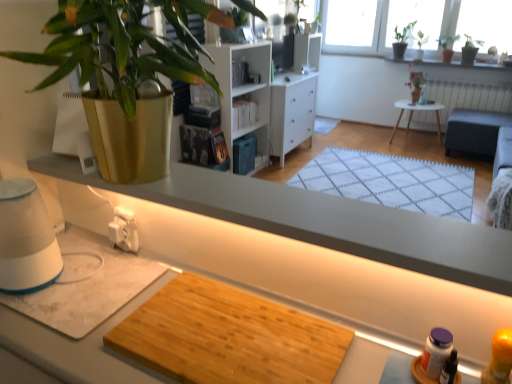
This screenshot has width=512, height=384. What do you see at coordinates (78, 347) in the screenshot? I see `wooden cutting board at center` at bounding box center [78, 347].

Describe the element at coordinates (447, 46) in the screenshot. I see `green leafy plant at upper right, which is the second houseplant from back to front` at that location.

The width and height of the screenshot is (512, 384). Describe the element at coordinates (401, 41) in the screenshot. I see `green leafy plant at upper right, the second houseplant when ordered from left to right` at that location.

Locate an element on the screen. green matte plant at upper right, the 2th houseplant in the front-to-back sequence is located at coordinates (470, 50).

Image resolution: width=512 pixels, height=384 pixels. Describe the element at coordinates (391, 181) in the screenshot. I see `white woven mat at center` at that location.

Based on the photo, in order to face white woven mat at center, should I rotate leftwards or rightwards?

Turn right approximately 16.758 degrees to face it.

Image resolution: width=512 pixels, height=384 pixels. What do you see at coordinates (291, 112) in the screenshot? I see `white wood cabinet at center` at bounding box center [291, 112].

Locate an element on the screen. gold metallic pot at upper left, marked as the 1th houseplant in a left-to-right arrangement is located at coordinates (122, 58).

Locate an element on the screen. This screenshot has width=512, height=384. wooden cutting board at center is located at coordinates (78, 347).

How distant is gold metallic pot at upper left, which appears as the 4th houseplant when viewed from the back, from white painted radiator at upper right?

The distance of gold metallic pot at upper left, which appears as the 4th houseplant when viewed from the back, from white painted radiator at upper right is 16.09 feet.

From a real-world perspective, does gold metallic pot at upper left, marked as the 1th houseplant in a left-to-right arrangement, sit lower than white painted radiator at upper right?

Actually, gold metallic pot at upper left, marked as the 1th houseplant in a left-to-right arrangement, is physically above white painted radiator at upper right in the real world.

Which object is closer to the camera, gold metallic pot at upper left, positioned as the 1th houseplant in front-to-back order, or white painted radiator at upper right?

gold metallic pot at upper left, positioned as the 1th houseplant in front-to-back order.

Is gold metallic pot at upper left, positioned as the 1th houseplant in front-to-back order, surrounding white painted radiator at upper right?

That's incorrect, white painted radiator at upper right is not inside gold metallic pot at upper left, positioned as the 1th houseplant in front-to-back order.

Is green matte plant at upper right, which ranks as the 3th houseplant in top-to-bottom order, far away from white woven mat at center?

Absolutely, green matte plant at upper right, which ranks as the 3th houseplant in top-to-bottom order, is distant from white woven mat at center.

This screenshot has height=384, width=512. I want to click on the 2nd houseplant located above the white woven mat at center (from a real-world perspective), so [x=470, y=50].

From a real-world perspective, is green matte plant at upper right, the 1th houseplant when ordered from right to left, above or below white woven mat at center?

green matte plant at upper right, the 1th houseplant when ordered from right to left, is above white woven mat at center.

Can you tell me how much green matte plant at upper right, which appears as the third houseplant when viewed from the back, and white woven mat at center differ in facing direction?

The angular difference between green matte plant at upper right, which appears as the third houseplant when viewed from the back, and white woven mat at center is 0.205 degrees.

Which point is more forward, (286, 112) or (224, 118)?

Positioned in front is point (224, 118).

Considering the sizes of objects white wood cabinet at center and white wood bookshelf at center in the image provided, who is taller, white wood cabinet at center or white wood bookshelf at center?

white wood cabinet at center is taller.

Which object is closer to the camera, white wood cabinet at center or white wood bookshelf at center?

white wood bookshelf at center is in front.

Find the location of a particular element. The image size is (512, 384). cabinetry below the white wood bookshelf at center (from the image's perspective) is located at coordinates (291, 112).

I want to click on radiator behind the white wood bookshelf at center, so click(469, 97).

From a real-world perspective, between white wood bookshelf at center and white painted radiator at upper right, who is vertically higher?

white wood bookshelf at center, from a real-world perspective.

Would you say white wood bookshelf at center is outside white painted radiator at upper right?

Indeed, white wood bookshelf at center is completely outside white painted radiator at upper right.

Which is in front, point (245, 113) or point (479, 87)?

Point (245, 113)

Is wooden cutting board at center aimed at green leafy plant at upper right, which is the 3th houseplant in front-to-back order?

No, wooden cutting board at center is not turned towards green leafy plant at upper right, which is the 3th houseplant in front-to-back order.

Considering the sizes of objects wooden cutting board at center and green leafy plant at upper right, which is the second houseplant from back to front, in the image provided, who is taller, wooden cutting board at center or green leafy plant at upper right, which is the second houseplant from back to front,?

green leafy plant at upper right, which is the second houseplant from back to front.

Is wooden cutting board at center smaller than green leafy plant at upper right, which is the 3th houseplant in front-to-back order?

Yes.

Does white wood cabinet at center appear on the left side of green leafy plant at upper right, acting as the 3th houseplant starting from the bottom?

Correct, you'll find white wood cabinet at center to the left of green leafy plant at upper right, acting as the 3th houseplant starting from the bottom.

From a real-world perspective, is white wood cabinet at center above or below green leafy plant at upper right, which is the third houseplant from left to right?

From a real-world perspective, white wood cabinet at center is physically below green leafy plant at upper right, which is the third houseplant from left to right.

Measure the distance between white wood cabinet at center and green leafy plant at upper right, which is counted as the second houseplant, starting from the top.

2.27 meters.

Considering the relative sizes of white wood cabinet at center and green leafy plant at upper right, which appears as the second houseplant when viewed from the right, in the image provided, is white wood cabinet at center smaller than green leafy plant at upper right, which appears as the second houseplant when viewed from the right,?

No, white wood cabinet at center is not smaller than green leafy plant at upper right, which appears as the second houseplant when viewed from the right.

Which is correct: wooden cutting board at center is inside green matte plant at upper right, the 2th houseplant in the front-to-back sequence, or outside of it?

The correct answer is: outside.

Is wooden cutting board at center looking in the opposite direction of green matte plant at upper right, which ranks as the 3th houseplant in top-to-bottom order?

Yes, wooden cutting board at center is facing away from green matte plant at upper right, which ranks as the 3th houseplant in top-to-bottom order.

Image resolution: width=512 pixels, height=384 pixels. I want to click on desk that appears in front of the green matte plant at upper right, which ranks as the 3th houseplant in top-to-bottom order, so coord(78,347).

At what (x,y) coordinates should I click in order to perform the action: click on radiator that appears on the right of gold metallic pot at upper left, marked as the 1th houseplant in a left-to-right arrangement. Please return your answer as a coordinate pair (x, y). Looking at the image, I should click on (469, 97).

Find the location of a particular element. This screenshot has height=384, width=512. mat below the green matte plant at upper right, the 2th houseplant in the front-to-back sequence (from a real-world perspective) is located at coordinates (391, 181).

When comparing their distances from white wood bookshelf at center, does gold metallic pot at upper left, which appears as the 4th houseplant when viewed from the back, or green matte plant at upper right, the 1th houseplant when ordered from right to left, seem closer?

gold metallic pot at upper left, which appears as the 4th houseplant when viewed from the back.

Considering their positions, is white wood bookshelf at center positioned further to gold metallic pot at upper left, positioned as the 4th houseplant in right-to-left order, than green leafy plant at upper right, acting as the 3th houseplant starting from the bottom?

Among the two, green leafy plant at upper right, acting as the 3th houseplant starting from the bottom, is located further to gold metallic pot at upper left, positioned as the 4th houseplant in right-to-left order.

Estimate the real-world distances between objects in this image. Which object is further from gold metallic pot at upper left, positioned as the 4th houseplant in right-to-left order, wooden cutting board at center or wooden cutting board at center?

Among the two, wooden cutting board at center is located further to gold metallic pot at upper left, positioned as the 4th houseplant in right-to-left order.

Estimate the real-world distances between objects in this image. Which object is further from white painted radiator at upper right, white woven mat at center or green matte plant at upper right, the 2th houseplant in the front-to-back sequence?

white woven mat at center is positioned further to the anchor white painted radiator at upper right.

From the image, which object appears to be nearer to white wood bookshelf at center, green leafy plant at upper right, the second houseplant when ordered from left to right, or wooden cutting board at center?

Based on the image, wooden cutting board at center appears to be nearer to white wood bookshelf at center.

Based on their spatial positions, is white woven mat at center or white wood cabinet at center further from white wood bookshelf at center?

Based on the image, white woven mat at center appears to be further to white wood bookshelf at center.

When comparing their distances from white woven mat at center, does white wood cabinet at center or white wooden table at center seem further?

white wooden table at center is further to white woven mat at center.

In the scene shown: Looking at the image, which one is located further to green leafy plant at upper right, acting as the 3th houseplant starting from the bottom, white wooden table at center or green matte plant at upper right, the 1th houseplant when ordered from right to left?

white wooden table at center lies further to green leafy plant at upper right, acting as the 3th houseplant starting from the bottom, than the other object.

What are the coordinates of `cabinetry located between wooden cutting board at center and green leafy plant at upper right, the second houseplant when ordered from left to right, in the depth direction` in the screenshot? It's located at (291, 112).

At what (x,y) coordinates should I click in order to perform the action: click on shelf positioned between gold metallic pot at upper left, marked as the 1th houseplant in a left-to-right arrangement, and white woven mat at center from near to far. Please return your answer as a coordinate pair (x, y). The width and height of the screenshot is (512, 384). Looking at the image, I should click on (243, 94).

The image size is (512, 384). What are the coordinates of `plywood between gold metallic pot at upper left, arranged as the first houseplant when ordered from the bottom, and green matte plant at upper right, the 2th houseplant positioned from the bottom, in the front-back direction` in the screenshot? It's located at (228, 337).

The image size is (512, 384). I want to click on mat positioned between wooden cutting board at center and white painted radiator at upper right from near to far, so click(391, 181).